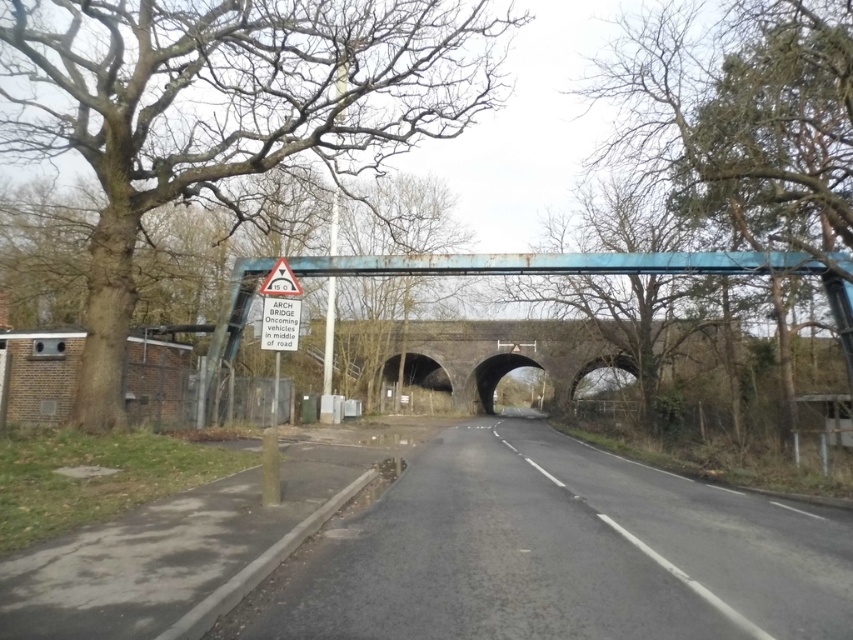
Between rusty metal bridge at center and white triangular warning sign at upper center, which one appears on the right side from the viewer's perspective?

Positioned to the right is rusty metal bridge at center.

Does point (492, 365) lie in front of point (285, 269)?

No, (492, 365) is further to viewer.

You are a GUI agent. You are given a task and a screenshot of the screen. Output one action in this format:
    pyautogui.click(x=<x>, y=<y>)
    Task: Click on the rusty metal bridge at center
    This screenshot has height=640, width=853.
    Given the screenshot: What is the action you would take?
    pyautogui.click(x=480, y=353)

Is blue metallic bridge at center closer to the viewer compared to white triangular warning sign at upper center?

No, it is behind white triangular warning sign at upper center.

Who is more distant from viewer, (640, 260) or (285, 288)?

Point (640, 260)

Does point (836, 280) come closer to viewer compared to point (271, 280)?

No, (836, 280) is behind (271, 280).

Locate an element on the screen. The height and width of the screenshot is (640, 853). blue metallic bridge at center is located at coordinates (601, 269).

Can you confirm if bare wood tree at left is bigger than rusty metal bridge at center?

Indeed, bare wood tree at left has a larger size compared to rusty metal bridge at center.

Based on the photo, can you confirm if bare wood tree at left is positioned to the left of rusty metal bridge at center?

Yes, bare wood tree at left is to the left of rusty metal bridge at center.

Locate an element on the screen. Image resolution: width=853 pixels, height=640 pixels. bare wood tree at left is located at coordinates (224, 109).